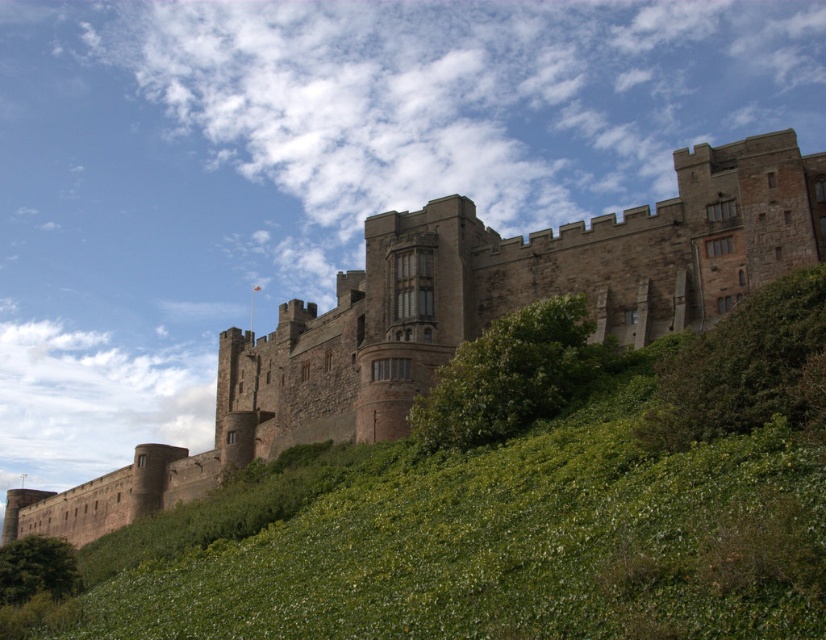
You are standing at the base of the hill looking up at the castle. You notice both the green leafy grass at lower center and the green leafy hedge at center. Which of these two objects is closer to you?

The green leafy grass at lower center is closer to you because it is positioned in front of the green leafy hedge at center.

You are a bird flying over the historic stone castle. You want to land on the highest point in the scene. Which object should you choose between the brown stone castle at center and the green leafy hedge at center?

The brown stone castle at center is much taller than the green leafy hedge at center, so you should land on the brown stone castle at center as it is the highest point available.

You are a tourist standing at the base of the hill facing the castle. You want to take a photo of the castle but need to ensure you can see the green leafy grass at lower center in the foreground. Given that your camera has a maximum focus range of 25 meters, will you be able to capture both the castle and the grass clearly in the same photo?

The green leafy grass at lower center is 25.42 meters away from the camera. Since the camera can only focus up to 25 meters, it cannot capture both the castle and the grass clearly in the same photo because the grass is slightly beyond the focus range.